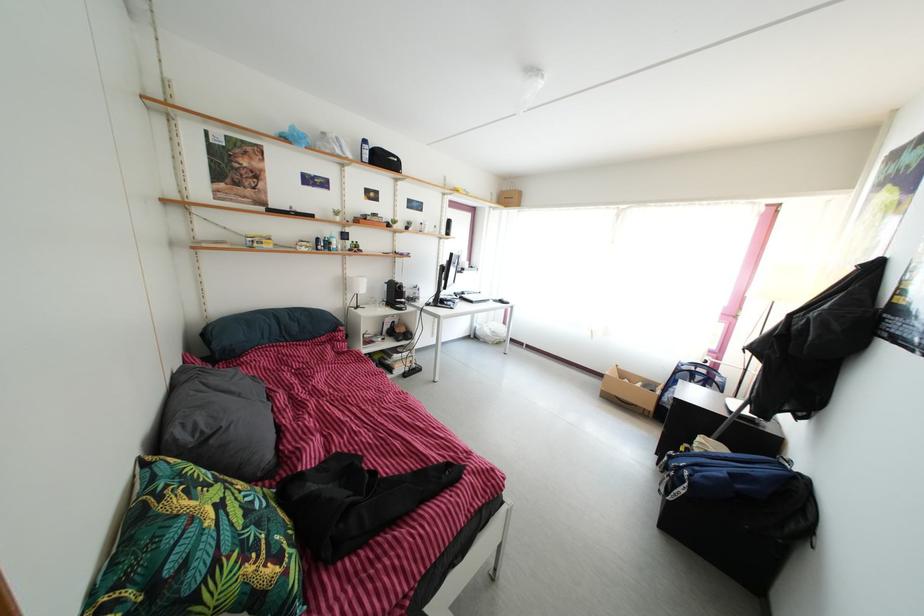
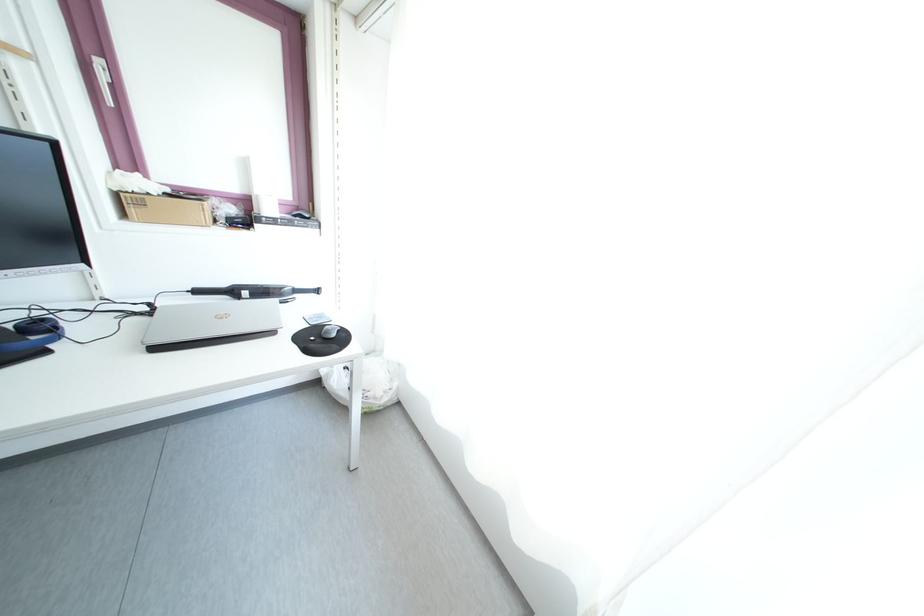
Locate, in the second image, the point that corresponds to [492,342] in the first image.

(344, 403)